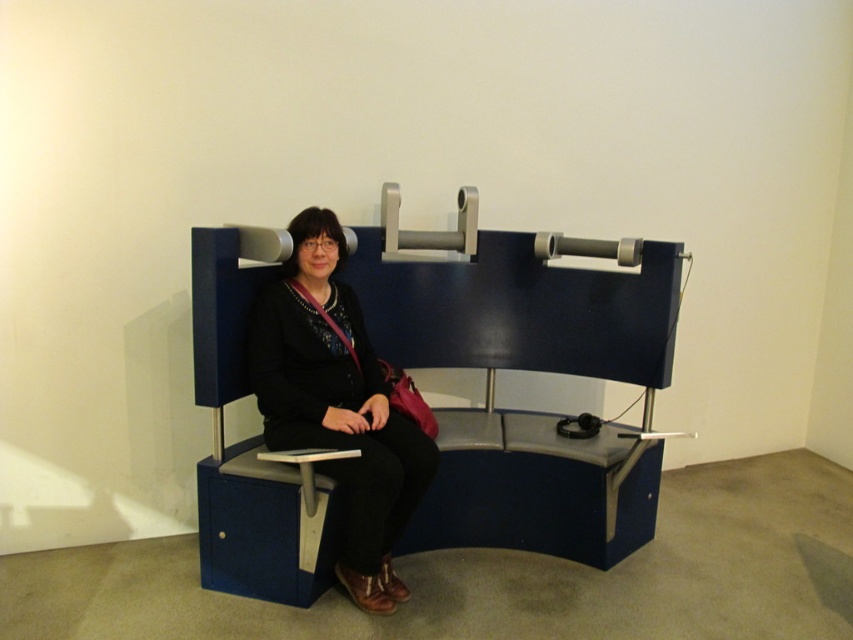
Question: Does blue plastic bench at center have a greater width compared to matte black jacket at center?

Choices:
 (A) yes
 (B) no

Answer: (A)

Question: Which point is farther to the camera?

Choices:
 (A) matte black jacket at center
 (B) blue plastic bench at center

Answer: (B)

Question: Is blue plastic bench at center wider than matte black jacket at center?

Choices:
 (A) no
 (B) yes

Answer: (B)

Question: Where is blue plastic bench at center located in relation to matte black jacket at center in the image?

Choices:
 (A) above
 (B) below

Answer: (A)

Question: Which point is farther to the camera?

Choices:
 (A) (473, 440)
 (B) (364, 563)

Answer: (A)

Question: Which point is farther from the camera taking this photo?

Choices:
 (A) (376, 554)
 (B) (436, 337)

Answer: (B)